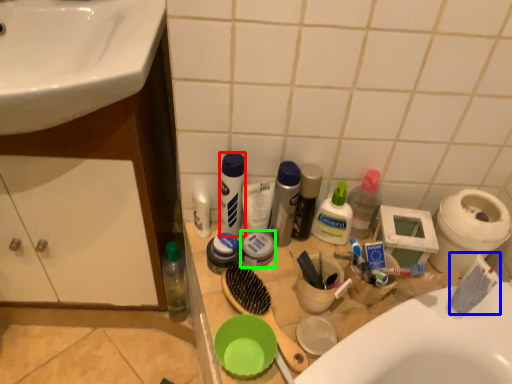
Question: Which is farther away from toiletry (highlighted by a red box)? toothpaste (highlighted by a blue box) or toiletry (highlighted by a green box)?

Choices:
 (A) toothpaste
 (B) toiletry

Answer: (A)